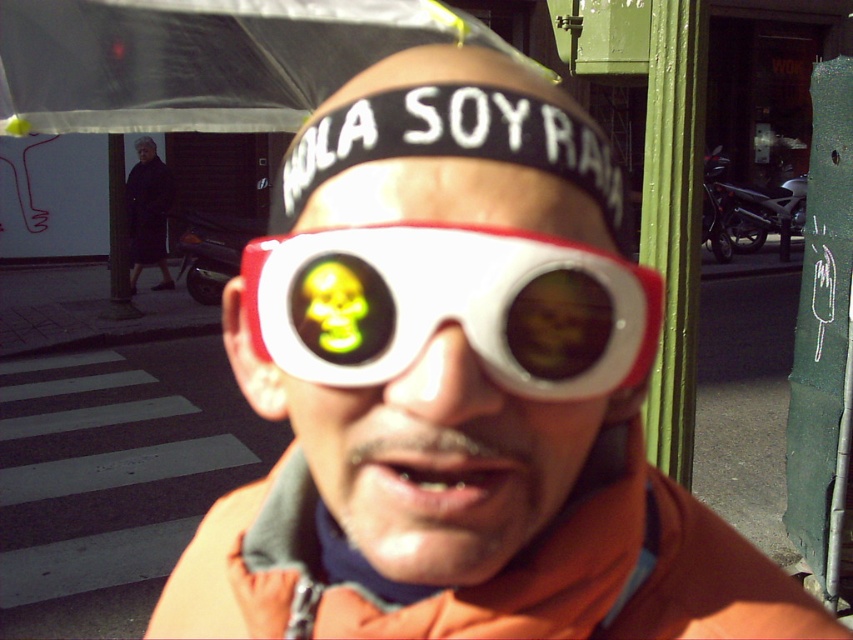
Question: Based on their relative distances, which object is farther from the white plastic goggles at center?

Choices:
 (A) matte black sunglasses at center
 (B) white matte sunglasses at center

Answer: (A)

Question: Is brown matte eye at center smaller than matte black sunglasses at center?

Choices:
 (A) yes
 (B) no

Answer: (A)

Question: Which object is the farthest from the matte black sunglasses at center?

Choices:
 (A) white plastic goggles at center
 (B) brown matte eye at center
 (C) dark wool coat at left

Answer: (B)

Question: Is dark wool coat at left bigger than matte black sunglasses at center?

Choices:
 (A) yes
 (B) no

Answer: (A)

Question: Observing the image, what is the correct spatial positioning of dark wool coat at left in reference to matte black sunglasses at center?

Choices:
 (A) above
 (B) below

Answer: (B)

Question: Among these points, which one is farthest from the camera?

Choices:
 (A) (163, 202)
 (B) (555, 280)
 (C) (550, 278)
 (D) (369, 177)

Answer: (A)